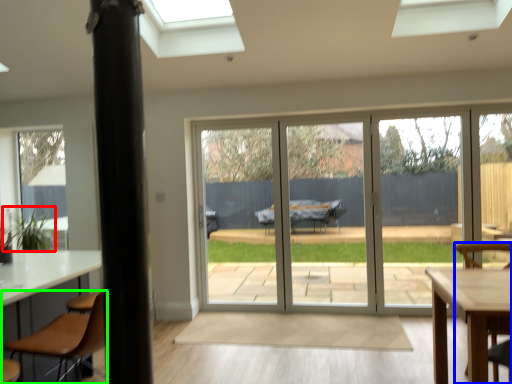
Question: Which is nearer to the plant (highlighted by a red box)? chair (highlighted by a blue box) or chair (highlighted by a green box).

Choices:
 (A) chair
 (B) chair

Answer: (B)